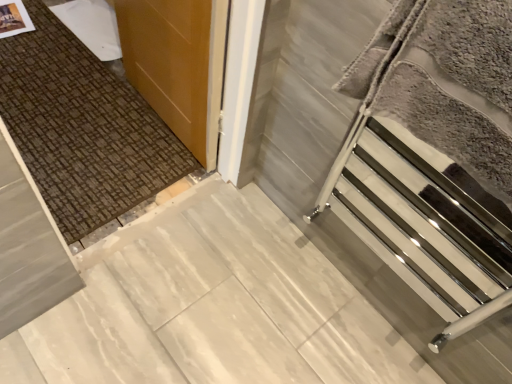
Question: Is silver metallic towel rack at right at the right side of white marble concrete at center?

Choices:
 (A) yes
 (B) no

Answer: (A)

Question: Can you confirm if silver metallic towel rack at right is smaller than white marble concrete at center?

Choices:
 (A) no
 (B) yes

Answer: (A)

Question: Is there a large distance between silver metallic towel rack at right and white marble concrete at center?

Choices:
 (A) yes
 (B) no

Answer: (B)

Question: From the image's perspective, is silver metallic towel rack at right beneath white marble concrete at center?

Choices:
 (A) no
 (B) yes

Answer: (A)

Question: Is silver metallic towel rack at right next to white marble concrete at center and touching it?

Choices:
 (A) yes
 (B) no

Answer: (B)

Question: Is silver metallic towel rack at right aimed at white marble concrete at center?

Choices:
 (A) no
 (B) yes

Answer: (A)

Question: From the image's perspective, does polished chrome towel rack at right appear lower than white marble concrete at center?

Choices:
 (A) yes
 (B) no

Answer: (B)

Question: Can you confirm if polished chrome towel rack at right is positioned to the right of white marble concrete at center?

Choices:
 (A) yes
 (B) no

Answer: (A)

Question: Considering the relative sizes of polished chrome towel rack at right and white marble concrete at center in the image provided, is polished chrome towel rack at right taller than white marble concrete at center?

Choices:
 (A) yes
 (B) no

Answer: (A)

Question: Could you tell me if polished chrome towel rack at right is turned towards white marble concrete at center?

Choices:
 (A) yes
 (B) no

Answer: (B)

Question: Could white marble concrete at center be considered to be inside polished chrome towel rack at right?

Choices:
 (A) no
 (B) yes

Answer: (A)

Question: Is polished chrome towel rack at right at the left side of white marble concrete at center?

Choices:
 (A) no
 (B) yes

Answer: (A)

Question: Is wooden door at upper left not close to silver metallic towel rack at right?

Choices:
 (A) yes
 (B) no

Answer: (B)